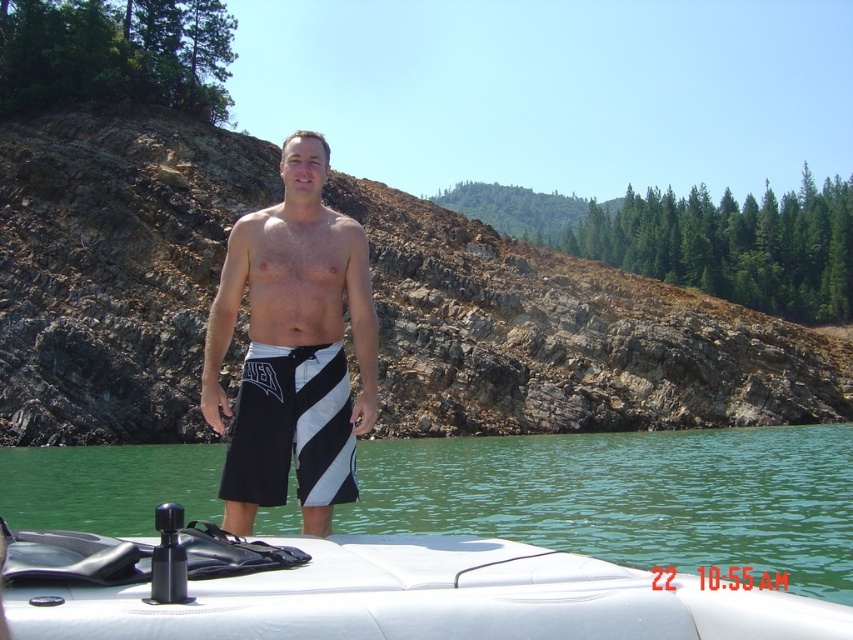
Between green water at center and black and white striped shorts at center, which one is positioned higher?

black and white striped shorts at center

What do you see at coordinates (630, 497) in the screenshot? This screenshot has height=640, width=853. I see `green water at center` at bounding box center [630, 497].

Locate an element on the screen. The height and width of the screenshot is (640, 853). green water at center is located at coordinates (630, 497).

Which is below, green water at center or black/white striped shorts at center?

green water at center is below.

Describe the element at coordinates (630, 497) in the screenshot. I see `green water at center` at that location.

Where is `green water at center`? Image resolution: width=853 pixels, height=640 pixels. green water at center is located at coordinates (630, 497).

Between white matte boat at center and black and white striped shorts at center, which one has more height?

With more height is white matte boat at center.

Is white matte boat at center positioned before black and white striped shorts at center?

Yes, white matte boat at center is in front of black and white striped shorts at center.

The width and height of the screenshot is (853, 640). I want to click on white matte boat at center, so click(368, 589).

The image size is (853, 640). What are the coordinates of `white matte boat at center` in the screenshot? It's located at (368, 589).